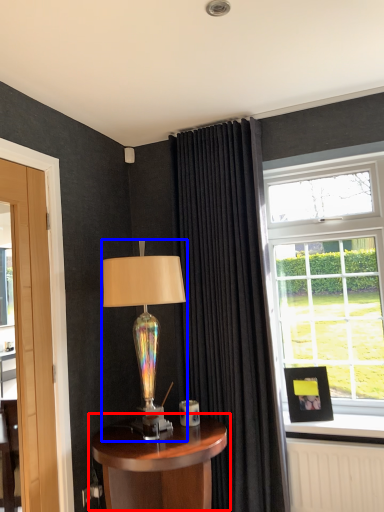
Question: Which of the following is the farthest to the observer, table (highlighted by a red box) or lamp (highlighted by a blue box)?

Choices:
 (A) table
 (B) lamp

Answer: (B)